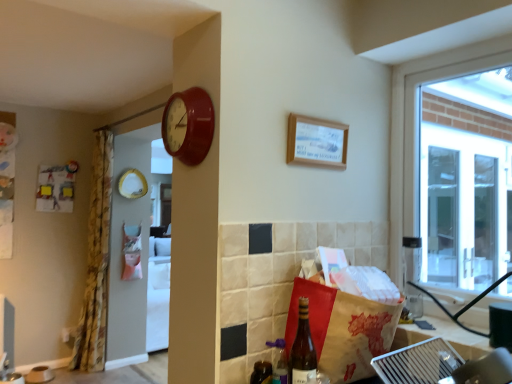
Question: Are floral fabric curtain at left and shiny dark brown bottle at lower center, the second bottle viewed from the front, making contact?

Choices:
 (A) yes
 (B) no

Answer: (B)

Question: Could you tell me if floral fabric curtain at left is turned towards shiny dark brown bottle at lower center, the second bottle viewed from the front?

Choices:
 (A) no
 (B) yes

Answer: (A)

Question: Can you confirm if floral fabric curtain at left is shorter than shiny dark brown bottle at lower center, the second bottle viewed from the front?

Choices:
 (A) yes
 (B) no

Answer: (B)

Question: From a real-world perspective, is floral fabric curtain at left positioned over shiny dark brown bottle at lower center, marked as the 1th bottle in a back-to-front arrangement, based on gravity?

Choices:
 (A) yes
 (B) no

Answer: (A)

Question: From the image's perspective, is floral fabric curtain at left on top of shiny dark brown bottle at lower center, marked as the 1th bottle in a back-to-front arrangement?

Choices:
 (A) yes
 (B) no

Answer: (A)

Question: Based on their sizes in the image, would you say matte red clock at upper center is bigger or smaller than translucent glass bottle at lower right?

Choices:
 (A) small
 (B) big

Answer: (B)

Question: Considering the positions of matte red clock at upper center and translucent glass bottle at lower right in the image, is matte red clock at upper center wider or thinner than translucent glass bottle at lower right?

Choices:
 (A) wide
 (B) thin

Answer: (B)

Question: Is point (184, 112) positioned closer to the camera than point (307, 352)?

Choices:
 (A) farther
 (B) closer

Answer: (A)

Question: In the image, is matte red clock at upper center on the left side or the right side of translucent glass bottle at lower right?

Choices:
 (A) left
 (B) right

Answer: (A)

Question: From a real-world perspective, relative to matte red clock at upper center, is shiny dark brown bottle at lower center, the second bottle viewed from the front, vertically above or below?

Choices:
 (A) below
 (B) above

Answer: (A)

Question: Considering their positions, is shiny dark brown bottle at lower center, marked as the 1th bottle in a back-to-front arrangement, located in front of or behind matte red clock at upper center?

Choices:
 (A) front
 (B) behind

Answer: (B)

Question: Is point (250, 375) positioned closer to the camera than point (195, 105)?

Choices:
 (A) closer
 (B) farther

Answer: (B)

Question: Is shiny dark brown bottle at lower center, the second bottle viewed from the front, bigger or smaller than matte red clock at upper center?

Choices:
 (A) small
 (B) big

Answer: (A)

Question: Which is correct: shiny dark brown bottle at lower center, marked as the 1th bottle in a back-to-front arrangement, is inside translucent glass bottle at lower center, the second bottle viewed from the back, or outside of it?

Choices:
 (A) outside
 (B) inside

Answer: (A)

Question: From the image's perspective, is shiny dark brown bottle at lower center, the second bottle viewed from the front, positioned above or below translucent glass bottle at lower center, acting as the first bottle starting from the front?

Choices:
 (A) above
 (B) below

Answer: (B)